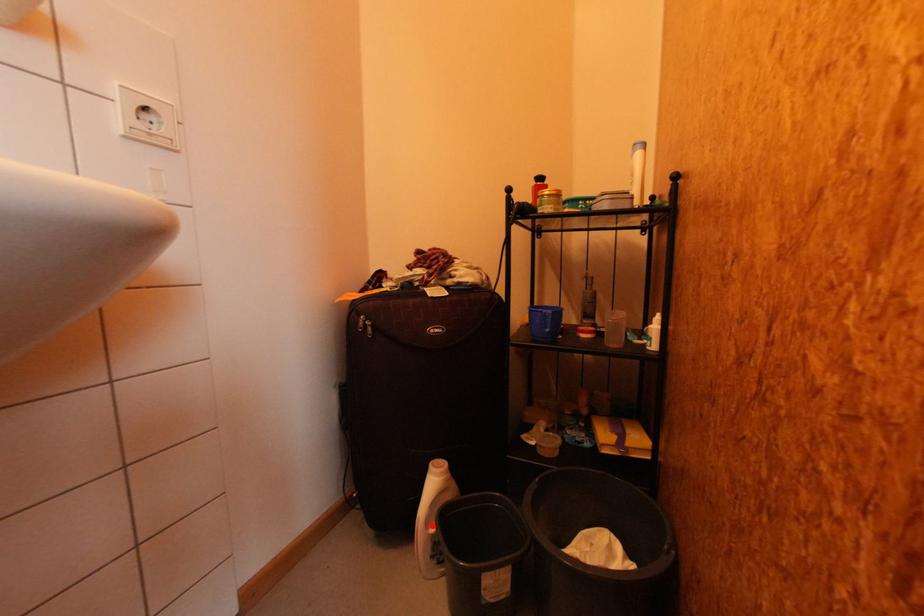
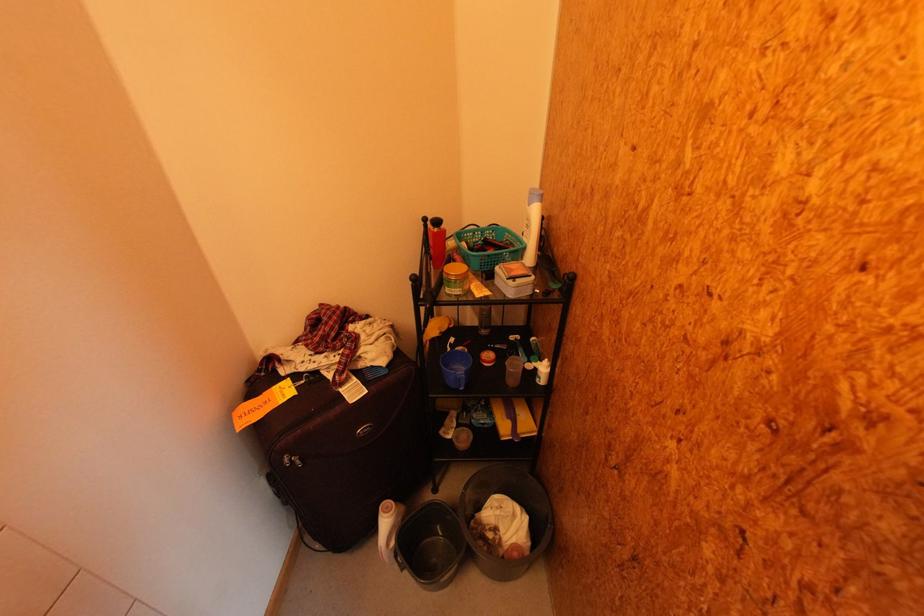
Locate, in the second image, the point that corresponds to the highlighted location in the first image.

(393, 546)